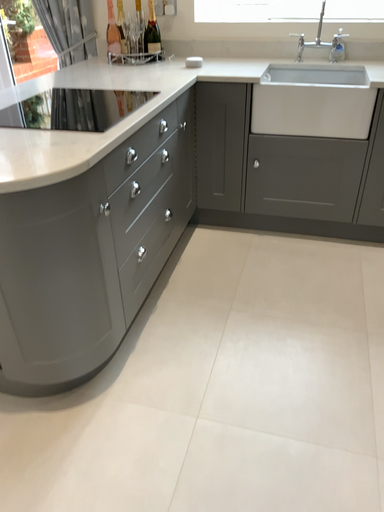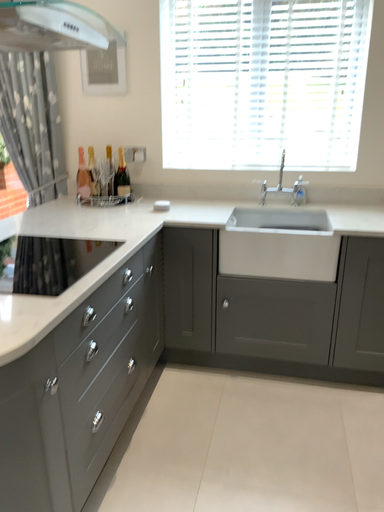
Question: Which way did the camera rotate in the video?

Choices:
 (A) rotated downward
 (B) rotated upward

Answer: (B)